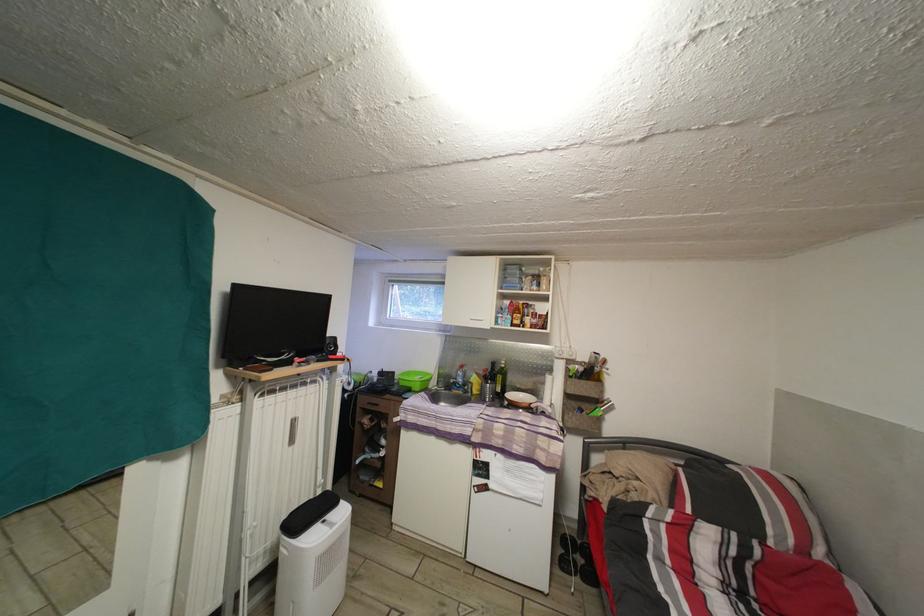
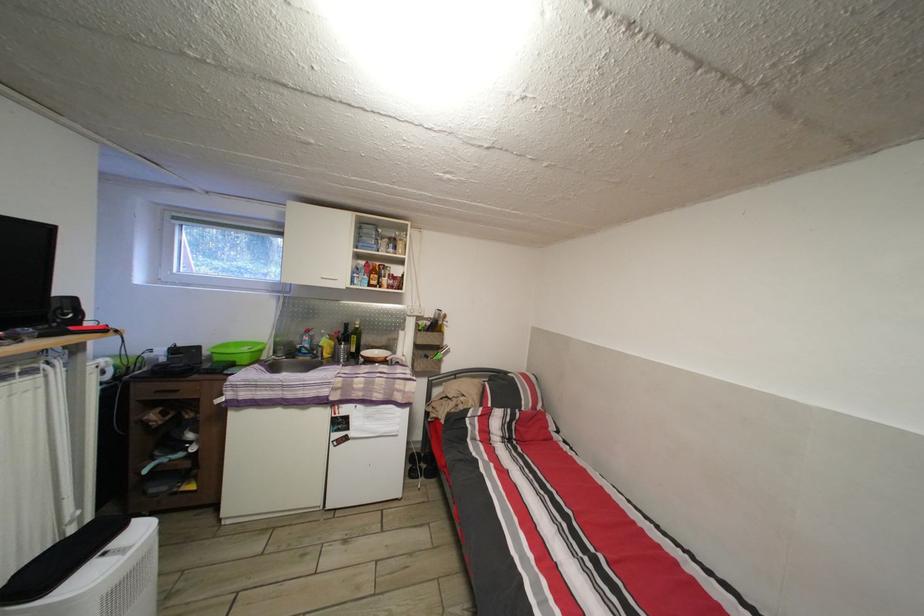
In the second image, find the point that corresponds to (x=477, y=392) in the first image.

(327, 355)